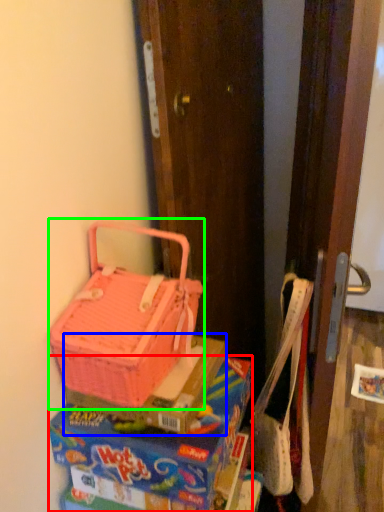
Question: Considering the real-world distances, which object is farthest from lunch box (highlighted by a red box)? box (highlighted by a blue box) or picnic basket (highlighted by a green box)?

Choices:
 (A) box
 (B) picnic basket

Answer: (B)